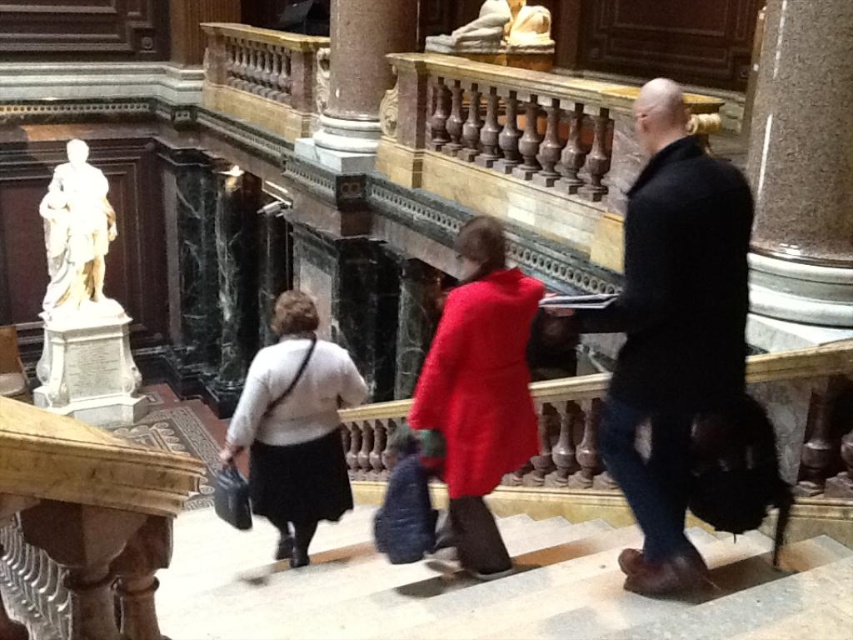
Question: Can you confirm if velvet red coat at center is positioned to the right of white sweater at center?

Choices:
 (A) no
 (B) yes

Answer: (B)

Question: Among these objects, which one is farthest from the camera?

Choices:
 (A) dark brown leather coat at center
 (B) velvet red coat at center
 (C) white sweater at center

Answer: (C)

Question: Which point is closer to the camera?

Choices:
 (A) (619, 305)
 (B) (51, 218)

Answer: (A)

Question: Is velvet red coat at center in front of white sweater at center?

Choices:
 (A) yes
 (B) no

Answer: (A)

Question: Which point appears closest to the camera in this image?

Choices:
 (A) (465, 323)
 (B) (277, 412)

Answer: (A)

Question: Is dark brown leather coat at center to the right of velvet red coat at center from the viewer's perspective?

Choices:
 (A) yes
 (B) no

Answer: (A)